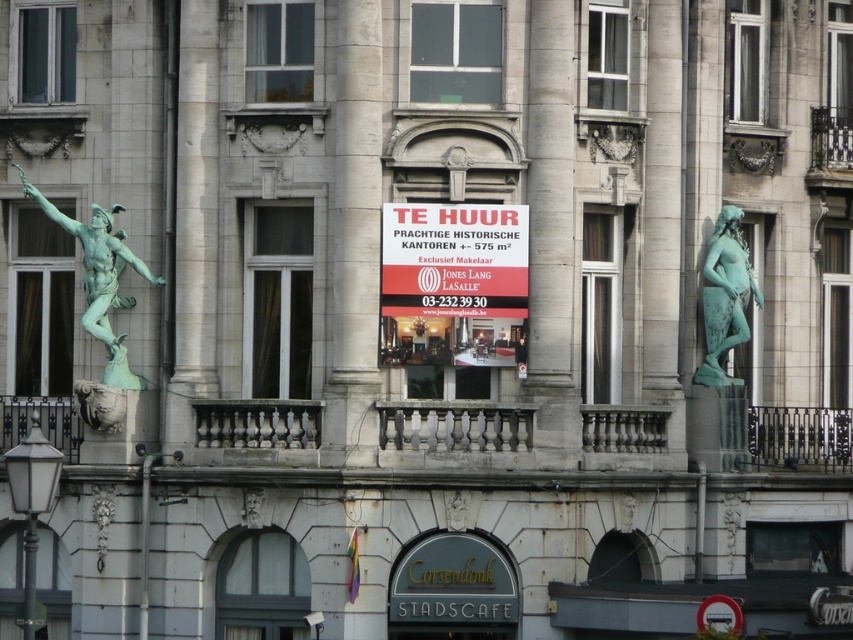
You are standing in front of the classical building and want to locate the red plastic sign at center. Based on the coordinates provided, where exactly would you look?

The red plastic sign at center is located at point coordinates (454,259).